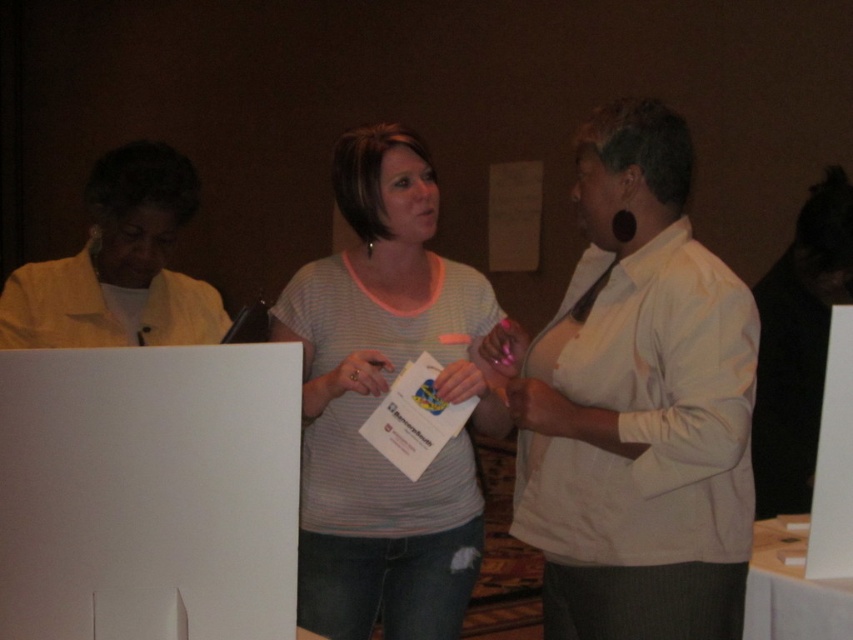
Does point (672, 624) come closer to viewer compared to point (22, 266)?

Yes, point (672, 624) is in front of point (22, 266).

Where is `white matte shirt at center`? Image resolution: width=853 pixels, height=640 pixels. white matte shirt at center is located at coordinates (636, 404).

Measure the distance from white matte shirt at center to light gray striped shirt at center.

The distance of white matte shirt at center from light gray striped shirt at center is 33.87 centimeters.

Is point (659, 467) closer to camera compared to point (463, 512)?

That is True.

Identify the location of white matte shirt at center. (636, 404).

The height and width of the screenshot is (640, 853). What do you see at coordinates (381, 397) in the screenshot?
I see `light gray striped shirt at center` at bounding box center [381, 397].

From the picture: Who is positioned more to the left, light gray striped shirt at center or light beige jacket at left?

Positioned to the left is light beige jacket at left.

What are the coordinates of `light gray striped shirt at center` in the screenshot? It's located at (381, 397).